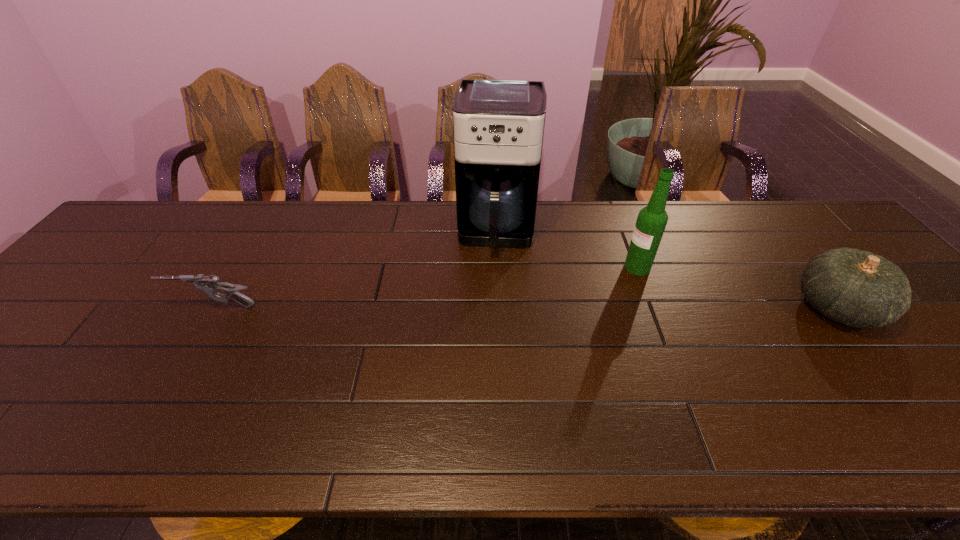
In the image, there is a desktop. Where is `vacant space at the far edge`? vacant space at the far edge is located at coordinates (723, 221).

This screenshot has width=960, height=540. I want to click on vacant space at the near edge of the desktop, so click(846, 402).

This screenshot has height=540, width=960. Identify the location of blank space at the left edge of the desktop. (115, 291).

Find the location of a particular element. The height and width of the screenshot is (540, 960). free space between the gun and the tallest object is located at coordinates (355, 269).

Locate an element on the screen. vacant region between the tallest object and the gun is located at coordinates (355, 269).

You are a GUI agent. You are given a task and a screenshot of the screen. Output one action in this format:
    pyautogui.click(x=<x>, y=<y>)
    Task: Click on the empty location between the tallest object and the gourd
    
    Given the screenshot: What is the action you would take?
    pyautogui.click(x=667, y=269)

At what (x,y) coordinates should I click in order to perform the action: click on free area in between the second object from left to right and the shortest object. Please return your answer as a coordinate pair (x, y). The width and height of the screenshot is (960, 540). Looking at the image, I should click on (355, 269).

Where is `free point between the rightmost object and the second object from left to right`? The height and width of the screenshot is (540, 960). free point between the rightmost object and the second object from left to right is located at coordinates (667, 269).

Where is `empty space that is in between the second shortest object and the coffee maker`? empty space that is in between the second shortest object and the coffee maker is located at coordinates (667, 269).

Locate an element on the screen. free spot between the coffee maker and the shortest object is located at coordinates (355, 269).